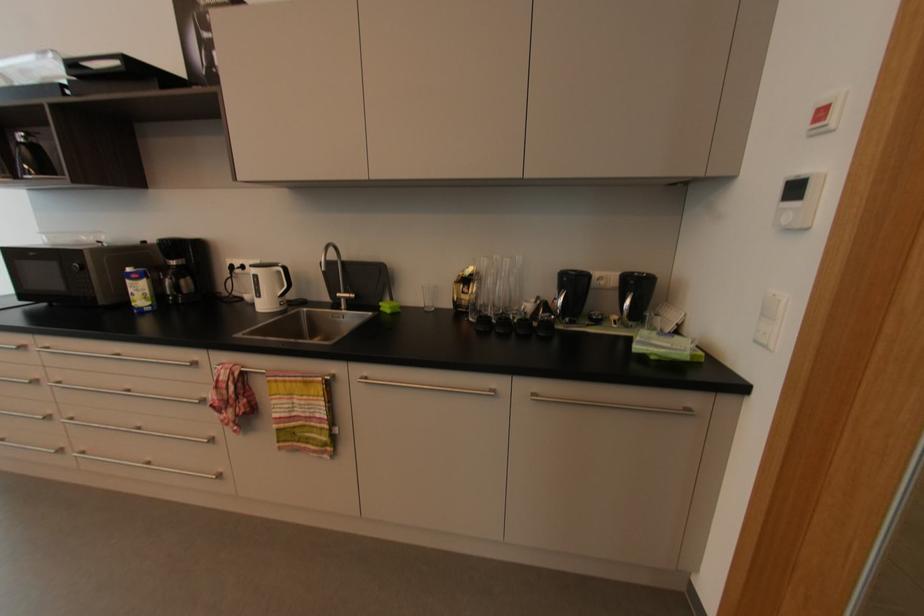
Locate an element on the screen. white light switch is located at coordinates (771, 320).